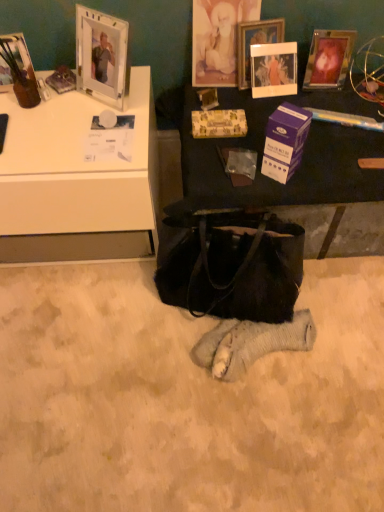
Question: Considering the relative positions of gold textured picture frame at upper center, acting as the 3th picture frame starting from the right, and matte glass picture frame at upper left, marked as the 4th picture frame in a right-to-left arrangement, in the image provided, is gold textured picture frame at upper center, acting as the 3th picture frame starting from the right, to the right of matte glass picture frame at upper left, marked as the 4th picture frame in a right-to-left arrangement, from the viewer's perspective?

Choices:
 (A) yes
 (B) no

Answer: (A)

Question: Is gold textured picture frame at upper center, acting as the 3th picture frame starting from the right, to the left of matte glass picture frame at upper left, marked as the 4th picture frame in a right-to-left arrangement, from the viewer's perspective?

Choices:
 (A) no
 (B) yes

Answer: (A)

Question: Is gold textured picture frame at upper center, acting as the 3th picture frame starting from the right, placed right next to matte glass picture frame at upper left, placed as the first picture frame when sorted from left to right?

Choices:
 (A) yes
 (B) no

Answer: (B)

Question: Is gold textured picture frame at upper center, which is the second picture frame in left-to-right order, outside of matte glass picture frame at upper left, placed as the first picture frame when sorted from left to right?

Choices:
 (A) yes
 (B) no

Answer: (A)

Question: Is gold textured picture frame at upper center, which is the second picture frame in left-to-right order, further to camera compared to matte glass picture frame at upper left, marked as the 4th picture frame in a right-to-left arrangement?

Choices:
 (A) yes
 (B) no

Answer: (A)

Question: From the image's perspective, is gold textured picture frame at upper center, which is the second picture frame in left-to-right order, located above or below purple cardboard box at center?

Choices:
 (A) below
 (B) above

Answer: (B)

Question: Considering the positions of gold textured picture frame at upper center, which is the second picture frame in left-to-right order, and purple cardboard box at center in the image, is gold textured picture frame at upper center, which is the second picture frame in left-to-right order, wider or thinner than purple cardboard box at center?

Choices:
 (A) wide
 (B) thin

Answer: (B)

Question: Based on their positions, is gold textured picture frame at upper center, acting as the 3th picture frame starting from the right, located to the left or right of purple cardboard box at center?

Choices:
 (A) right
 (B) left

Answer: (B)

Question: Is gold textured picture frame at upper center, which is the second picture frame in left-to-right order, taller or shorter than purple cardboard box at center?

Choices:
 (A) short
 (B) tall

Answer: (B)

Question: Is purple cardboard box at center inside or outside of gold textured picture frame at upper center, which is the second picture frame in left-to-right order?

Choices:
 (A) outside
 (B) inside

Answer: (A)

Question: From a real-world perspective, is purple cardboard box at center positioned above or below gold textured picture frame at upper center, acting as the 3th picture frame starting from the right?

Choices:
 (A) above
 (B) below

Answer: (B)

Question: From the image's perspective, is purple cardboard box at center positioned above or below gold textured picture frame at upper center, acting as the 3th picture frame starting from the right?

Choices:
 (A) below
 (B) above

Answer: (A)

Question: Considering the positions of purple cardboard box at center and gold textured picture frame at upper center, acting as the 3th picture frame starting from the right, in the image, is purple cardboard box at center bigger or smaller than gold textured picture frame at upper center, acting as the 3th picture frame starting from the right,?

Choices:
 (A) small
 (B) big

Answer: (A)

Question: Would you say matte black table at center is inside or outside matte glass picture frame at upper left, placed as the first picture frame when sorted from left to right?

Choices:
 (A) inside
 (B) outside

Answer: (B)

Question: In terms of width, does matte black table at center look wider or thinner when compared to matte glass picture frame at upper left, placed as the first picture frame when sorted from left to right?

Choices:
 (A) wide
 (B) thin

Answer: (A)